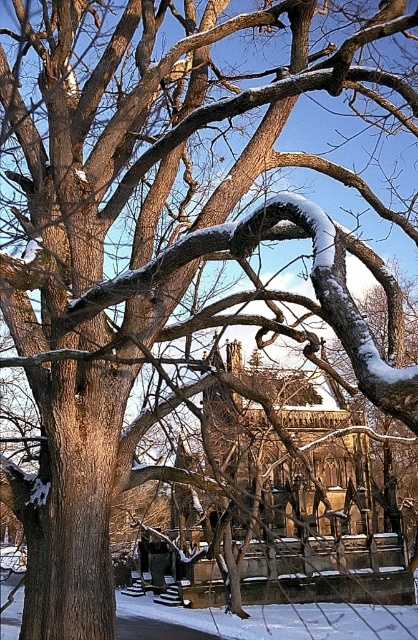
Is wooden park bench at center above wooden park bench at lower center?

Correct, wooden park bench at center is located above wooden park bench at lower center.

Does wooden park bench at center have a lesser width compared to wooden park bench at lower center?

No.

Is point (165, 592) farther from camera compared to point (142, 584)?

No, (165, 592) is in front of (142, 584).

This screenshot has width=418, height=640. What are the coordinates of `wooden park bench at center` in the screenshot? It's located at (171, 593).